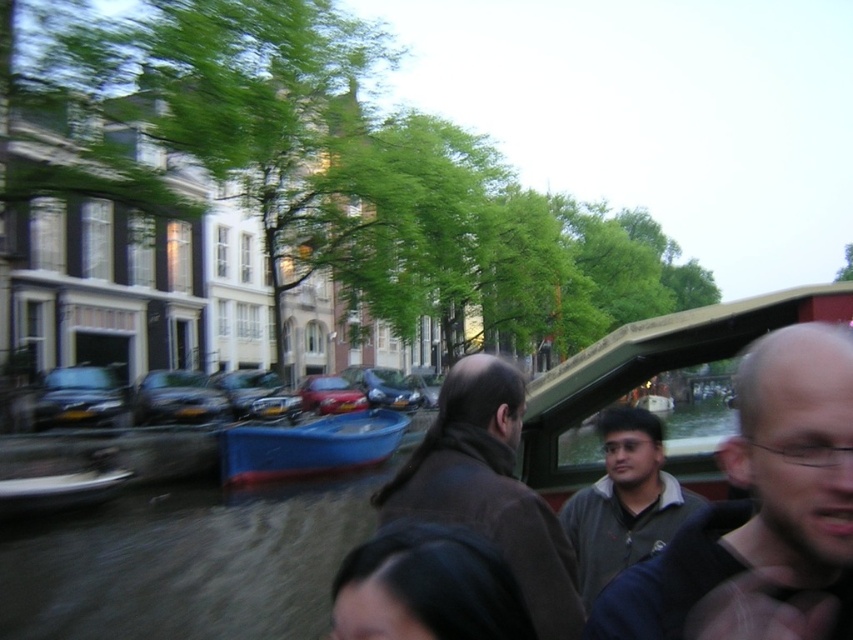
Can you confirm if black hair at lower center is bigger than blue plastic boat at center?

No, black hair at lower center is not bigger than blue plastic boat at center.

Between black hair at lower center and blue plastic boat at center, which one is positioned lower?

Positioned lower is blue plastic boat at center.

Which is behind, point (405, 538) or point (328, 417)?

The point (328, 417) is more distant.

This screenshot has height=640, width=853. I want to click on black hair at lower center, so click(427, 588).

Between dark gray sweater at center and gray fleece jacket at center, which one is positioned lower?

gray fleece jacket at center

Does dark gray sweater at center have a lesser height compared to gray fleece jacket at center?

Incorrect, dark gray sweater at center's height does not fall short of gray fleece jacket at center's.

Is point (844, 524) closer to camera compared to point (672, 522)?

That is True.

You are a GUI agent. You are given a task and a screenshot of the screen. Output one action in this format:
    pyautogui.click(x=<x>, y=<y>)
    Task: Click on the dark gray sweater at center
    Image resolution: width=853 pixels, height=640 pixels.
    Given the screenshot: What is the action you would take?
    pyautogui.click(x=761, y=513)

Does gray fleece jacket at center have a lesser width compared to blue plastic boat at center?

Yes.

Can you confirm if gray fleece jacket at center is positioned to the right of blue plastic boat at center?

Indeed, gray fleece jacket at center is positioned on the right side of blue plastic boat at center.

This screenshot has width=853, height=640. What do you see at coordinates (624, 500) in the screenshot?
I see `gray fleece jacket at center` at bounding box center [624, 500].

Locate an element on the screen. The width and height of the screenshot is (853, 640). gray fleece jacket at center is located at coordinates tap(624, 500).